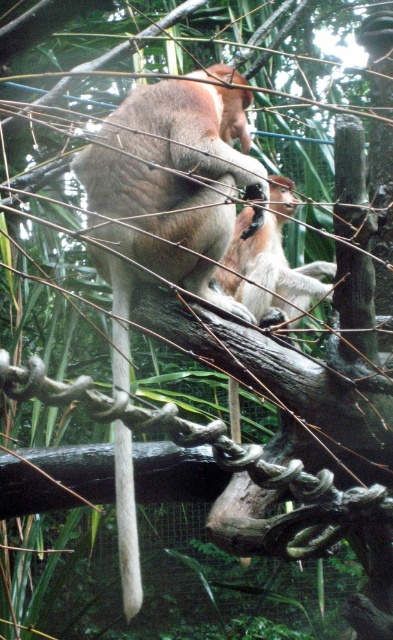
Question: Which of the following is the closest to the observer?

Choices:
 (A) light brown fur monkey at center
 (B) white matte tail at center
 (C) brown furry proboscis monkey at center

Answer: (B)

Question: Is brown furry proboscis monkey at center further to the viewer compared to white matte tail at center?

Choices:
 (A) no
 (B) yes

Answer: (B)

Question: Which object is farther from the camera taking this photo?

Choices:
 (A) brown furry proboscis monkey at center
 (B) light brown fur monkey at center
 (C) white matte tail at center

Answer: (B)

Question: Which of the following is the farthest from the observer?

Choices:
 (A) (124, 268)
 (B) (205, 227)
 (C) (238, 276)

Answer: (C)

Question: Is light brown fur monkey at center further to camera compared to white matte tail at center?

Choices:
 (A) yes
 (B) no

Answer: (A)

Question: Can you confirm if brown furry proboscis monkey at center is wider than light brown fur monkey at center?

Choices:
 (A) yes
 (B) no

Answer: (A)